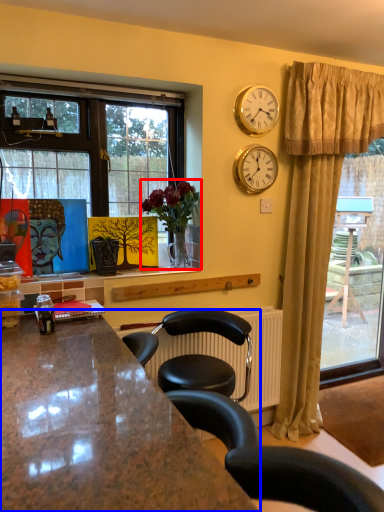
Question: Which of the following is the farthest to the observer, houseplant (highlighted by a red box) or countertop (highlighted by a blue box)?

Choices:
 (A) houseplant
 (B) countertop

Answer: (A)